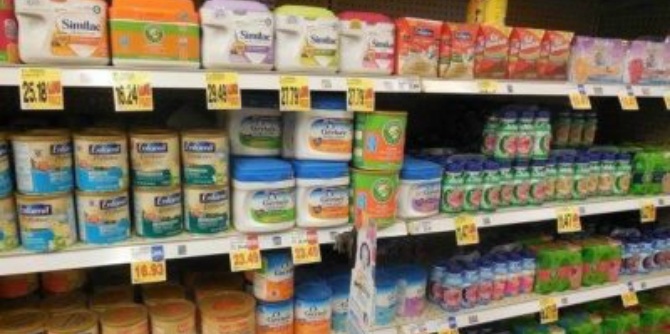
This screenshot has width=670, height=334. Identify the location of green food container. (541, 270).